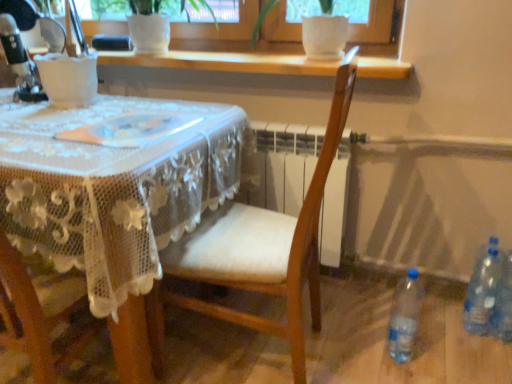
Question: Can clear plastic bottle at lower right, placed as the 1th bottle when sorted from right to left, be found inside white lace tablecloth at center?

Choices:
 (A) no
 (B) yes

Answer: (A)

Question: Is white lace tablecloth at center facing away from clear plastic bottle at lower right, the third bottle when ordered from left to right?

Choices:
 (A) no
 (B) yes

Answer: (A)

Question: Is white lace tablecloth at center aimed at clear plastic bottle at lower right, the third bottle when ordered from left to right?

Choices:
 (A) no
 (B) yes

Answer: (A)

Question: Can you confirm if white lace tablecloth at center is positioned to the right of clear plastic bottle at lower right, the third bottle when ordered from left to right?

Choices:
 (A) yes
 (B) no

Answer: (B)

Question: From the image's perspective, is white lace tablecloth at center on top of clear plastic bottle at lower right, the third bottle when ordered from left to right?

Choices:
 (A) no
 (B) yes

Answer: (B)

Question: From a real-world perspective, is transparent plastic bottle at lower right, the 3th bottle when ordered from right to left, positioned above or below white lace tablecloth at center?

Choices:
 (A) below
 (B) above

Answer: (A)

Question: Considering the positions of transparent plastic bottle at lower right, the 3th bottle when ordered from right to left, and white lace tablecloth at center in the image, is transparent plastic bottle at lower right, the 3th bottle when ordered from right to left, bigger or smaller than white lace tablecloth at center?

Choices:
 (A) small
 (B) big

Answer: (A)

Question: Is transparent plastic bottle at lower right, the 1th bottle in the left-to-right sequence, wider or thinner than white lace tablecloth at center?

Choices:
 (A) thin
 (B) wide

Answer: (A)

Question: Is transparent plastic bottle at lower right, the 1th bottle in the left-to-right sequence, in front of or behind white lace tablecloth at center in the image?

Choices:
 (A) behind
 (B) front

Answer: (A)

Question: Based on their positions, is clear plastic bottle at lower right, the third bottle when ordered from left to right, located to the left or right of transparent plastic bottle at lower right, the 3th bottle when ordered from right to left?

Choices:
 (A) left
 (B) right

Answer: (B)

Question: From a real-world perspective, is clear plastic bottle at lower right, placed as the 1th bottle when sorted from right to left, positioned above or below transparent plastic bottle at lower right, the 1th bottle in the left-to-right sequence?

Choices:
 (A) above
 (B) below

Answer: (A)

Question: Considering their positions, is clear plastic bottle at lower right, the third bottle when ordered from left to right, located in front of or behind transparent plastic bottle at lower right, the 1th bottle in the left-to-right sequence?

Choices:
 (A) behind
 (B) front

Answer: (A)

Question: Considering the positions of point (509, 274) and point (402, 304), is point (509, 274) closer or farther from the camera than point (402, 304)?

Choices:
 (A) farther
 (B) closer

Answer: (A)

Question: From the image's perspective, is clear plastic bottle at lower right, the second bottle viewed from the left, above or below metallic silver sewing machine at upper left?

Choices:
 (A) above
 (B) below

Answer: (B)

Question: Looking at their shapes, would you say clear plastic bottle at lower right, the second bottle viewed from the left, is wider or thinner than metallic silver sewing machine at upper left?

Choices:
 (A) wide
 (B) thin

Answer: (B)